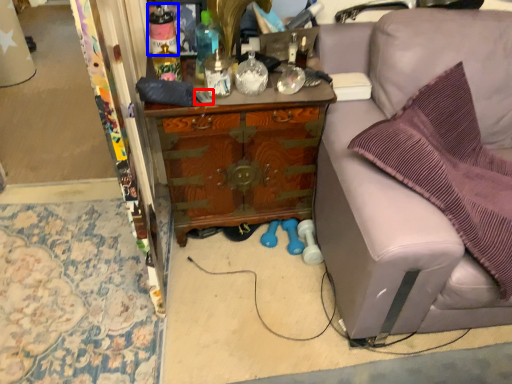
Question: Which point is closer to the camera, remote control (highlighted by a red box) or bottle (highlighted by a blue box)?

Choices:
 (A) remote control
 (B) bottle

Answer: (B)